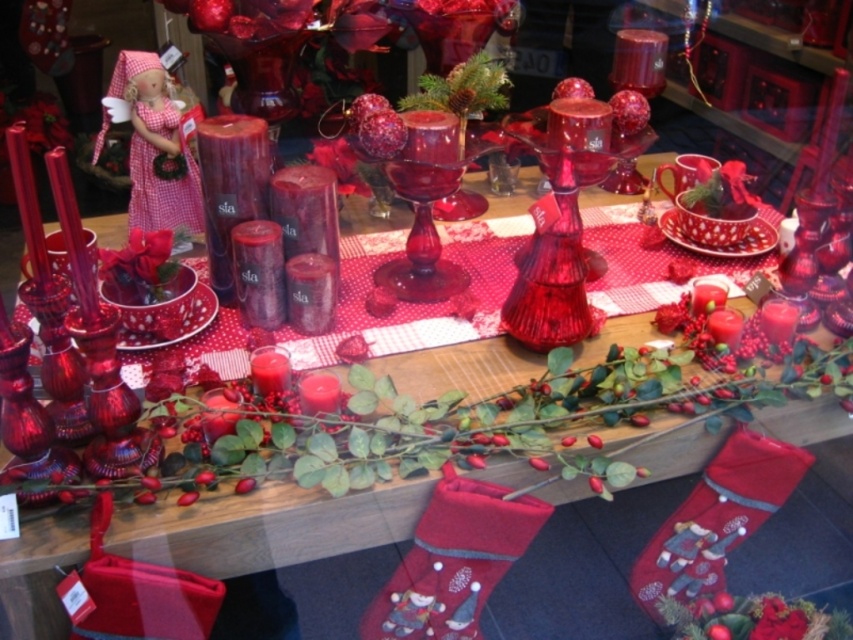
Is velvet red stocking at lower right wider than pink gingham doll at upper left?

Yes.

Is velvet red stocking at lower right below pink gingham doll at upper left?

Yes.

Image resolution: width=853 pixels, height=640 pixels. I want to click on velvet red stocking at lower right, so click(453, 561).